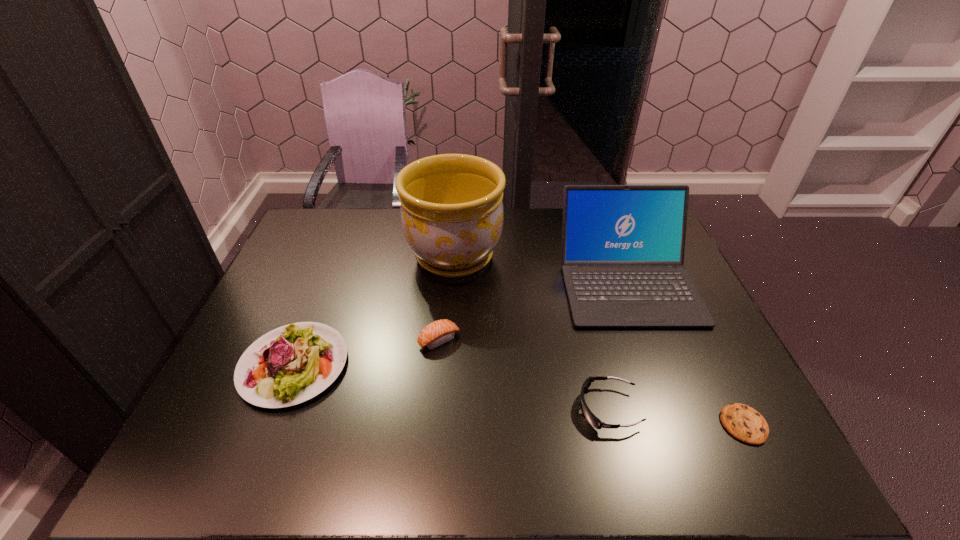
Locate an element on the screen. The height and width of the screenshot is (540, 960). cookie present at the right edge is located at coordinates (744, 423).

Find the location of a particular element. This screenshot has width=960, height=540. object situated at the far right corner is located at coordinates (623, 246).

You are a GUI agent. You are given a task and a screenshot of the screen. Output one action in this format:
    pyautogui.click(x=<x>, y=<y>)
    Task: Click on the object that is at the near right corner
    
    Given the screenshot: What is the action you would take?
    pyautogui.click(x=744, y=423)

Find the location of a particular element. free space at the far edge is located at coordinates (527, 241).

Where is `free space at the near edge of the desktop`? free space at the near edge of the desktop is located at coordinates (543, 451).

Where is `free location at the left edge of the desktop`? free location at the left edge of the desktop is located at coordinates (288, 298).

In order to click on vacant space at the right edge in this screenshot , I will do `click(716, 391)`.

I want to click on vacant space at the near right corner, so click(x=785, y=475).

Locate an element on the screen. The image size is (960, 540). free spot between the sushi and the fourth shortest object is located at coordinates (367, 353).

Identify the location of blank region between the laptop computer and the fourth shortest object. The width and height of the screenshot is (960, 540). (461, 323).